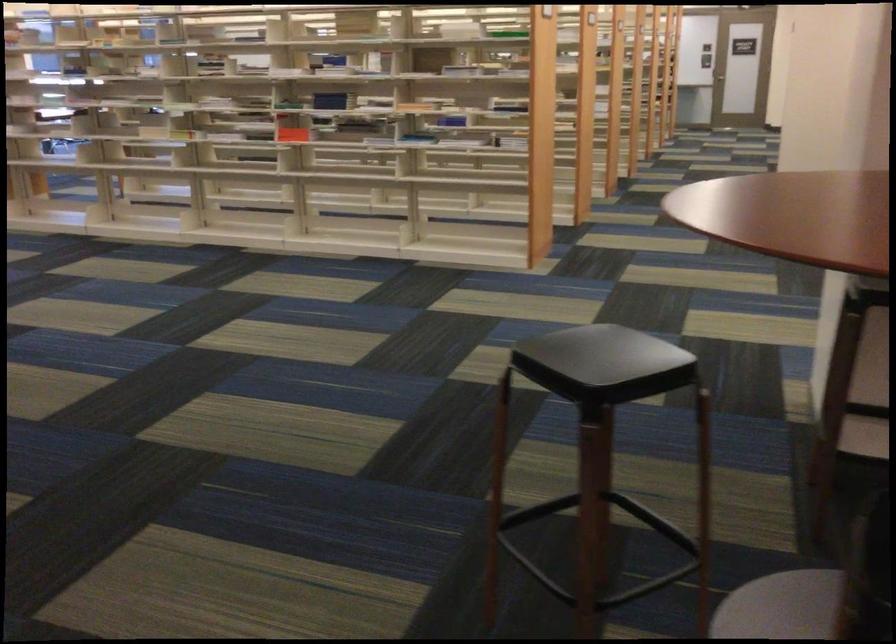
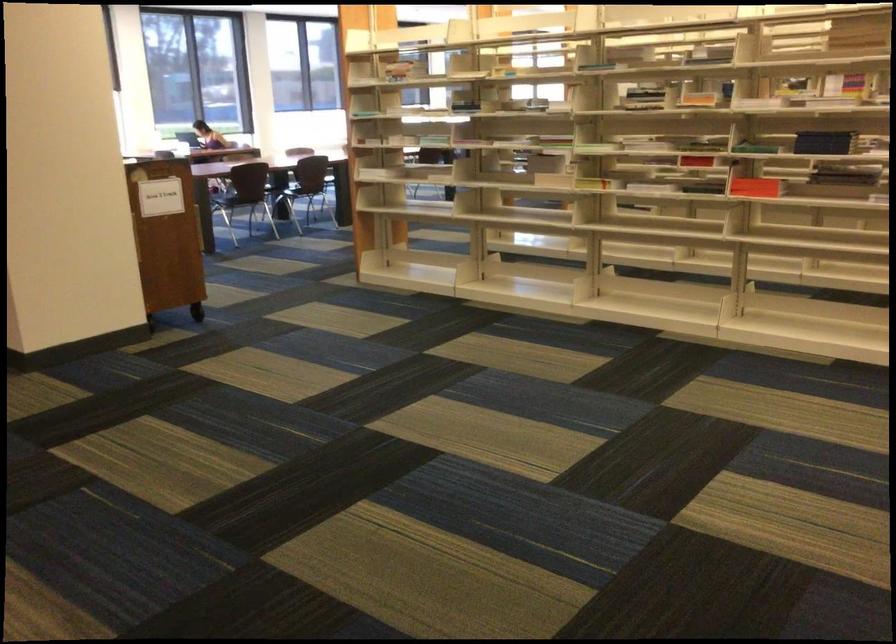
In a continuous first-person perspective shot, in which direction is the camera moving?

The cameraman walked toward left, forward.